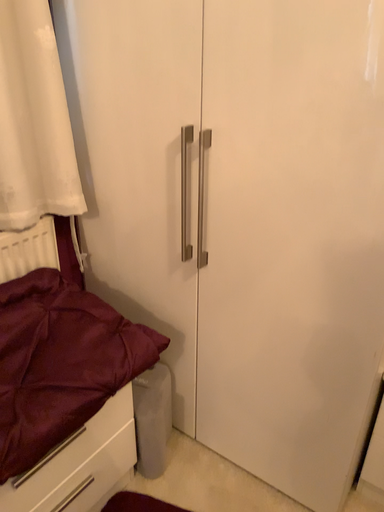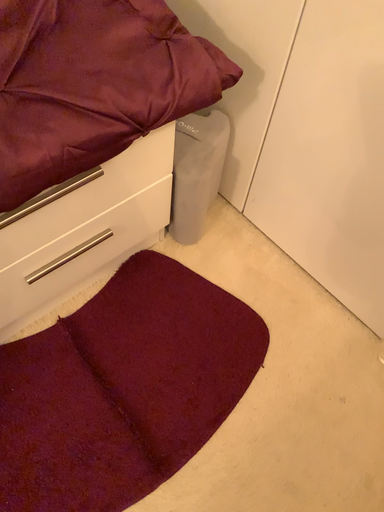
Question: Which way did the camera rotate in the video?

Choices:
 (A) rotated downward
 (B) rotated upward

Answer: (A)